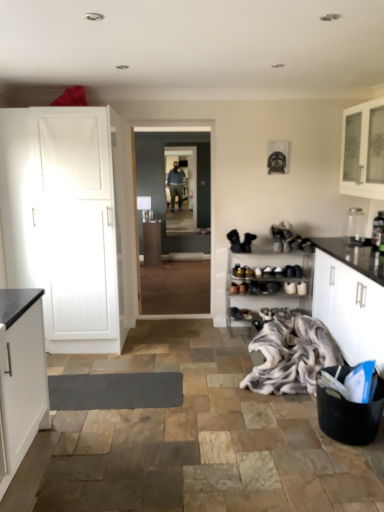
Question: Considering the positions of point (155, 249) and point (344, 430), is point (155, 249) closer or farther from the camera than point (344, 430)?

Choices:
 (A) closer
 (B) farther

Answer: (B)

Question: Considering the relative positions of matte wood cabinet at center, the 2th cabinetry ordered from the bottom, and black woven basket at lower right in the image provided, is matte wood cabinet at center, the 2th cabinetry ordered from the bottom, to the left or to the right of black woven basket at lower right?

Choices:
 (A) right
 (B) left

Answer: (B)

Question: Which object is positioned farthest from the black woven basket at lower right?

Choices:
 (A) wooden shoe rack at center
 (B) black suede shoes at center, marked as the second footwear in a bottom-to-top arrangement
 (C) metallic silver toaster at right, the second appliance in the back-to-front sequence
 (D) clear glass jar at upper right, which is the 2th appliance from front to back
 (E) matte wood cabinet at center, which ranks as the 3th cabinetry in front-to-back order

Answer: (E)

Question: Considering the real-world distances, which object is closest to the wooden shoe rack at center?

Choices:
 (A) matte wood cabinet at center, marked as the 1th cabinetry in a back-to-front arrangement
 (B) transparent glass door at center
 (C) clear glass jar at upper right, the 1th appliance from the back
 (D) white glass cabinet at upper right, which appears as the 3th cabinetry when viewed from the left
 (E) black woven basket at lower right

Answer: (C)